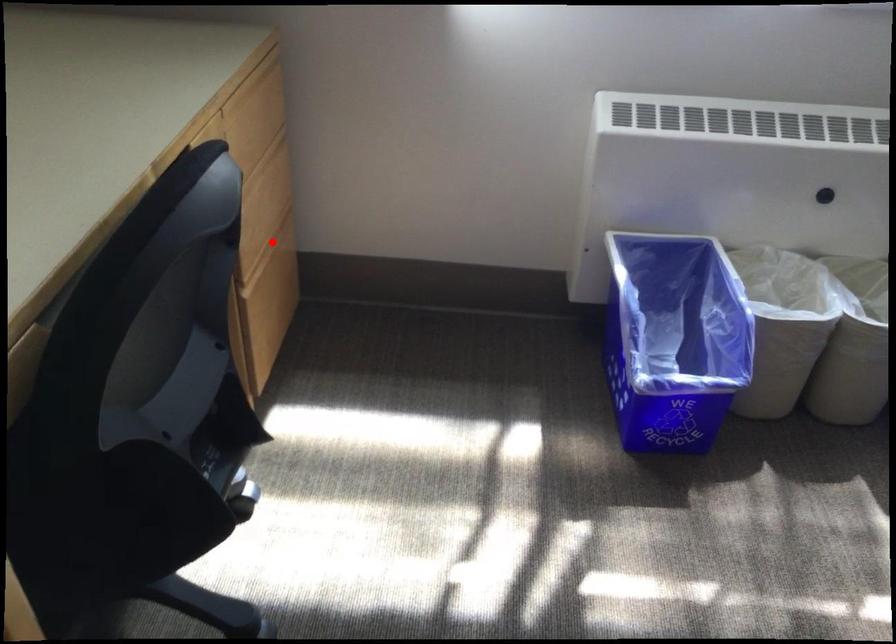
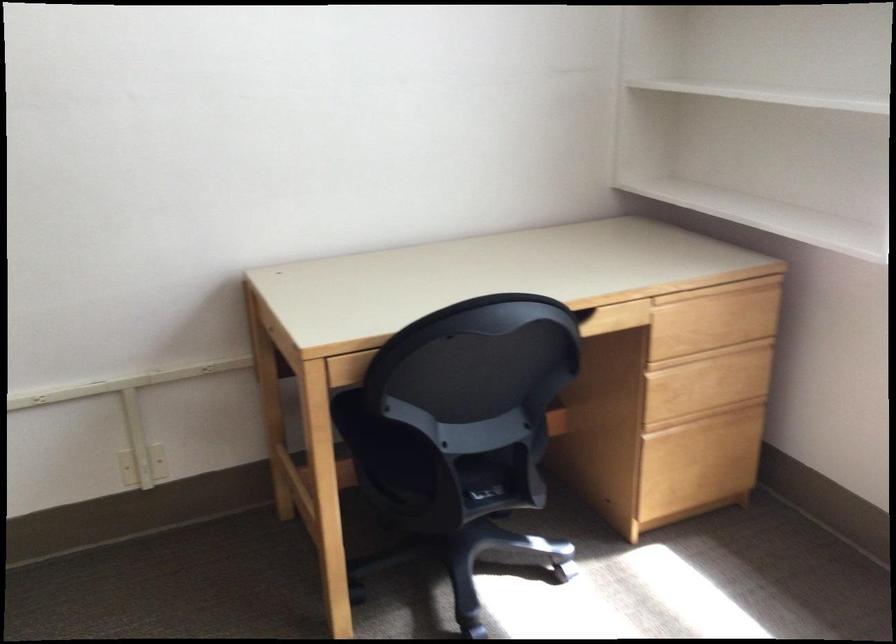
The point at the highlighted location is marked in the first image. Where is the corresponding point in the second image?

(709, 413)